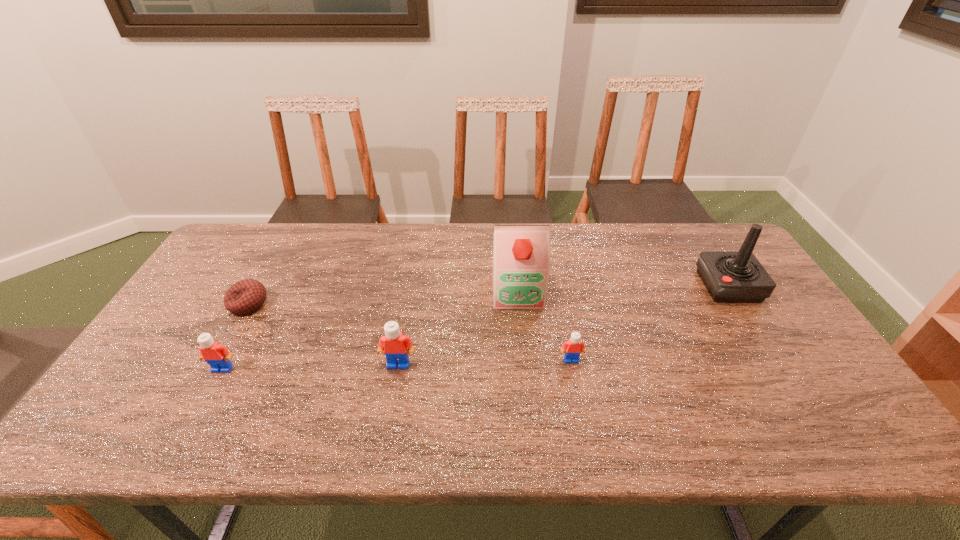
In the image, there is a desktop. Where is `vacant space at the near edge`? Image resolution: width=960 pixels, height=540 pixels. vacant space at the near edge is located at coordinates (414, 390).

You are a GUI agent. You are given a task and a screenshot of the screen. Output one action in this format:
    pyautogui.click(x=<x>, y=<y>)
    Task: Click on the vacant space at the left edge of the desktop
    Image resolution: width=960 pixels, height=540 pixels.
    Given the screenshot: What is the action you would take?
    pyautogui.click(x=201, y=278)

Find the location of a particular element. vacant area at the far left corner of the desktop is located at coordinates (242, 251).

Identify the location of vacant space at the far right corner. (695, 243).

Image resolution: width=960 pixels, height=540 pixels. In order to click on unoccupied area between the beanbag and the rightmost object in this screenshot , I will do `click(489, 295)`.

Identify the location of vacant space that's between the soya milk and the rightmost object. This screenshot has height=540, width=960. (623, 288).

You are a GUI agent. You are given a task and a screenshot of the screen. Output one action in this format:
    pyautogui.click(x=<x>, y=<y>)
    Task: Click on the vacant space in between the beanbag and the rightmost object
    This screenshot has height=540, width=960.
    Given the screenshot: What is the action you would take?
    pos(489,295)

At what (x,y) coordinates should I click in order to perform the action: click on vacant space that's between the shortest Lego and the second Lego from left to right. Please return your answer as a coordinate pair (x, y). Looking at the image, I should click on (485, 362).

Where is `free area in between the rightmost object and the second tallest Lego`? This screenshot has height=540, width=960. free area in between the rightmost object and the second tallest Lego is located at coordinates (475, 327).

This screenshot has height=540, width=960. In order to click on free spot between the fourth tallest object and the soya milk in this screenshot , I will do `click(370, 330)`.